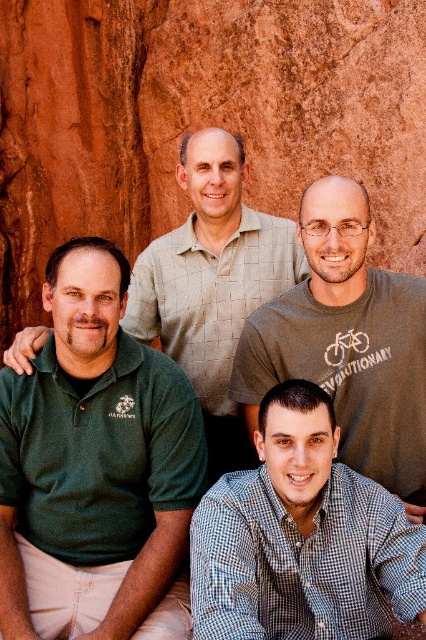
Which is behind, point (270, 529) or point (175, 317)?

Positioned behind is point (175, 317).

Is point (247, 632) positioned behind point (221, 433)?

No, it is in front of (221, 433).

Image resolution: width=426 pixels, height=640 pixels. Identify the location of checkered shirt at lower center. (302, 538).

Measure the distance between reddish-brown rock at center and green cotton shirt at upper center.

52.32 feet

Is point (333, 68) closer to viewer compared to point (336, 362)?

No, it is not.

This screenshot has width=426, height=640. I want to click on reddish-brown rock at center, so click(199, 116).

Which is more to the right, reddish-brown rock at center or green cotton polo shirt at upper center?

reddish-brown rock at center

Describe the element at coordinates (199, 116) in the screenshot. I see `reddish-brown rock at center` at that location.

Which is behind, point (26, 310) or point (207, 221)?

Point (26, 310)

I want to click on reddish-brown rock at center, so click(199, 116).